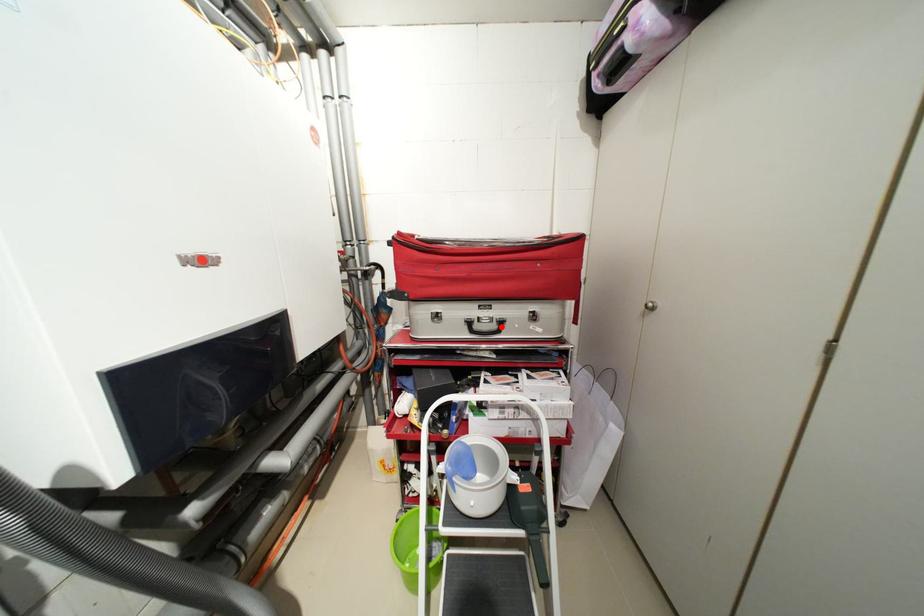
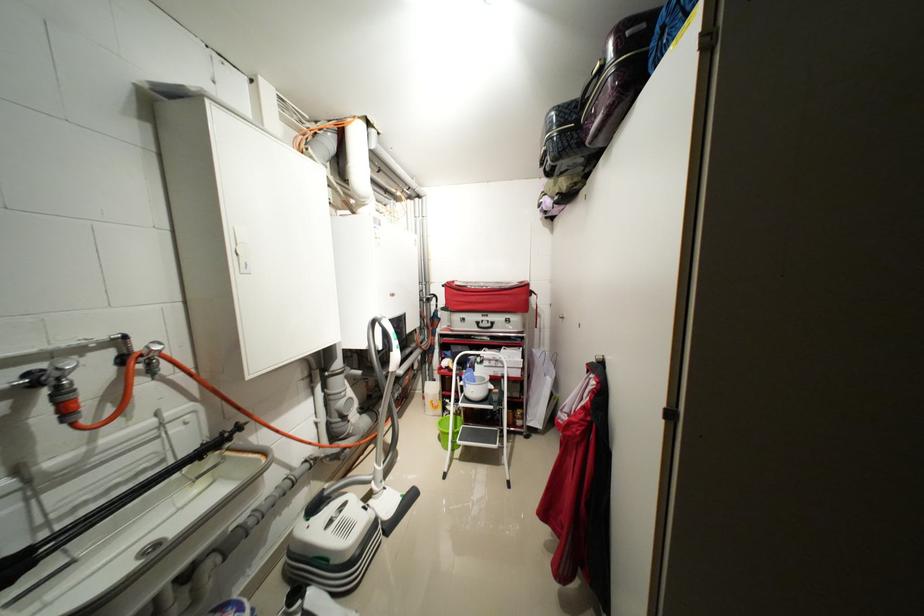
Where in the second image is the point corresponding to the highlighted location from the first image?

(496, 326)